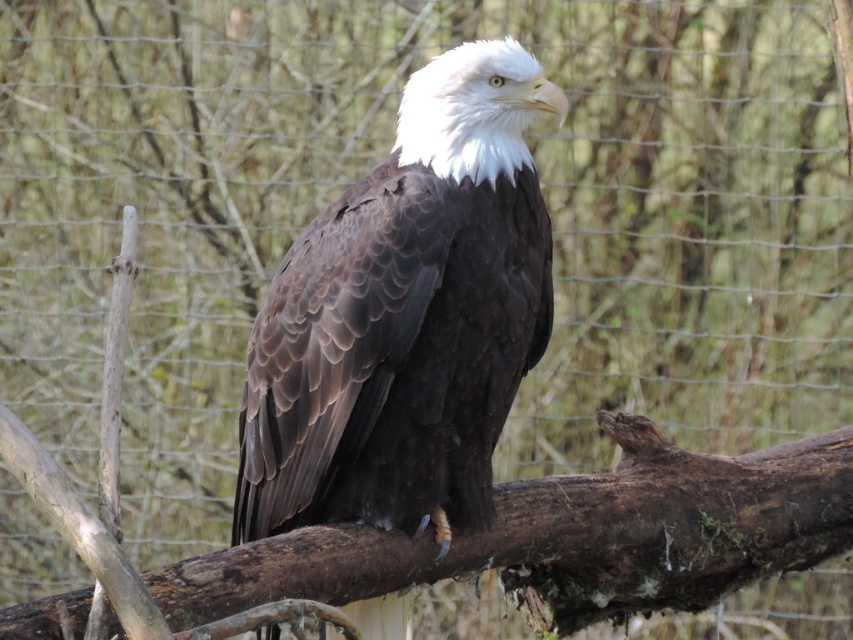
Question: Can you confirm if dark brown feathers at center is wider than brown rough wood at center?

Choices:
 (A) yes
 (B) no

Answer: (B)

Question: Does dark brown feathers at center appear over brown rough wood at center?

Choices:
 (A) yes
 (B) no

Answer: (A)

Question: Is dark brown feathers at center to the right of brown rough wood at center from the viewer's perspective?

Choices:
 (A) yes
 (B) no

Answer: (B)